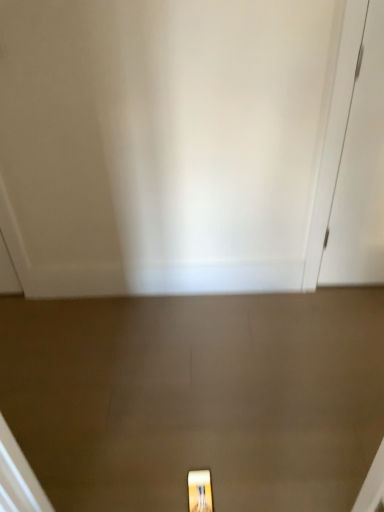
Question: Can you confirm if matte gold light fixture at lower center is shorter than white glossy door at center, which ranks as the 2th door in back-to-front order?

Choices:
 (A) no
 (B) yes

Answer: (B)

Question: Is matte gold light fixture at lower center looking in the opposite direction of white glossy door at center, acting as the 2th door starting from the right?

Choices:
 (A) no
 (B) yes

Answer: (A)

Question: Would you say matte gold light fixture at lower center is a long distance from white glossy door at center, which is the 1th door from front to back?

Choices:
 (A) yes
 (B) no

Answer: (A)

Question: From the image's perspective, would you say matte gold light fixture at lower center is positioned over white glossy door at center, which is the 1th door from front to back?

Choices:
 (A) yes
 (B) no

Answer: (B)

Question: Can you confirm if matte gold light fixture at lower center is positioned to the left of white glossy door at center, which is the 1th door from front to back?

Choices:
 (A) no
 (B) yes

Answer: (A)

Question: Considering the positions of white matte door at right, which is the first door in right-to-left order, and white glossy door at center, which ranks as the 2th door in back-to-front order, in the image, is white matte door at right, which is the first door in right-to-left order, wider or thinner than white glossy door at center, which ranks as the 2th door in back-to-front order,?

Choices:
 (A) wide
 (B) thin

Answer: (B)

Question: Is white matte door at right, placed as the 1th door when sorted from back to front, taller or shorter than white glossy door at center, which is the 1th door from left to right?

Choices:
 (A) short
 (B) tall

Answer: (A)

Question: Based on their positions, is white matte door at right, placed as the 1th door when sorted from back to front, located to the left or right of white glossy door at center, which is the 1th door from left to right?

Choices:
 (A) right
 (B) left

Answer: (A)

Question: Is point (382, 10) positioned closer to the camera than point (253, 87)?

Choices:
 (A) farther
 (B) closer

Answer: (B)

Question: Would you say matte gold light fixture at lower center is inside or outside white glossy door at center, which is the 1th door from front to back?

Choices:
 (A) outside
 (B) inside

Answer: (A)

Question: From the image's perspective, is matte gold light fixture at lower center positioned above or below white glossy door at center, acting as the 2th door starting from the right?

Choices:
 (A) above
 (B) below

Answer: (B)

Question: Is point (190, 505) closer or farther from the camera than point (321, 169)?

Choices:
 (A) closer
 (B) farther

Answer: (A)

Question: Considering the relative positions of matte gold light fixture at lower center and white glossy door at center, which is the 1th door from front to back, in the image provided, is matte gold light fixture at lower center to the left or to the right of white glossy door at center, which is the 1th door from front to back,?

Choices:
 (A) left
 (B) right

Answer: (B)

Question: Does point (190, 479) appear closer or farther from the camera than point (349, 161)?

Choices:
 (A) closer
 (B) farther

Answer: (A)

Question: Considering their positions, is matte gold light fixture at lower center located in front of or behind white matte door at right, placed as the 1th door when sorted from back to front?

Choices:
 (A) behind
 (B) front

Answer: (B)